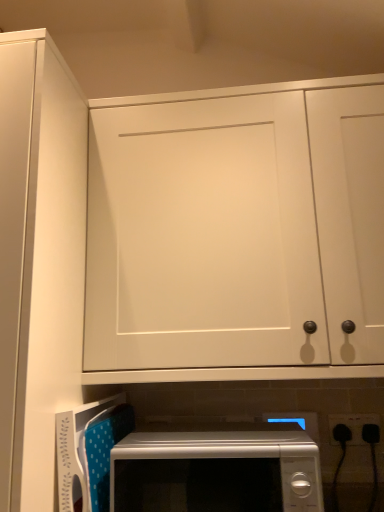
Question: From a real-world perspective, does white glossy microwave at lower center stand above black plastic electrical outlet at lower right?

Choices:
 (A) no
 (B) yes

Answer: (A)

Question: From the image's perspective, would you say white glossy microwave at lower center is positioned over black plastic electrical outlet at lower right?

Choices:
 (A) no
 (B) yes

Answer: (A)

Question: Considering the relative sizes of white glossy microwave at lower center and black plastic electrical outlet at lower right in the image provided, is white glossy microwave at lower center thinner than black plastic electrical outlet at lower right?

Choices:
 (A) yes
 (B) no

Answer: (B)

Question: From a real-world perspective, is white glossy microwave at lower center physically below black plastic electrical outlet at lower right?

Choices:
 (A) no
 (B) yes

Answer: (B)

Question: Can you confirm if white glossy microwave at lower center is smaller than black plastic electrical outlet at lower right?

Choices:
 (A) no
 (B) yes

Answer: (A)

Question: Is point (329, 428) closer or farther from the camera than point (233, 482)?

Choices:
 (A) farther
 (B) closer

Answer: (A)

Question: In terms of size, does black plastic electrical outlet at lower right appear bigger or smaller than white glossy microwave at lower center?

Choices:
 (A) small
 (B) big

Answer: (A)

Question: Relative to white glossy microwave at lower center, is black plastic electrical outlet at lower right in front or behind?

Choices:
 (A) front
 (B) behind

Answer: (B)

Question: Based on their positions, is black plastic electrical outlet at lower right located to the left or right of white glossy microwave at lower center?

Choices:
 (A) left
 (B) right

Answer: (B)

Question: From a real-world perspective, is white matte cabinet door at upper left, the 1th door from the left, physically located above or below white plastic microwave at lower center?

Choices:
 (A) below
 (B) above

Answer: (B)

Question: Looking at the image, does white matte cabinet door at upper left, the 1th door from the left, seem bigger or smaller compared to white plastic microwave at lower center?

Choices:
 (A) big
 (B) small

Answer: (A)

Question: Does point (39, 233) appear closer or farther from the camera than point (72, 451)?

Choices:
 (A) farther
 (B) closer

Answer: (B)

Question: From the image's perspective, relative to white plastic microwave at lower center, is white matte cabinet door at upper left, the 1th door from the left, above or below?

Choices:
 (A) above
 (B) below

Answer: (A)

Question: Considering the positions of point (276, 141) and point (129, 410), is point (276, 141) closer or farther from the camera than point (129, 410)?

Choices:
 (A) closer
 (B) farther

Answer: (A)

Question: From a real-world perspective, is white matte cabinet door at upper center, positioned as the second door in left-to-right order, positioned above or below white plastic microwave at lower center?

Choices:
 (A) above
 (B) below

Answer: (A)